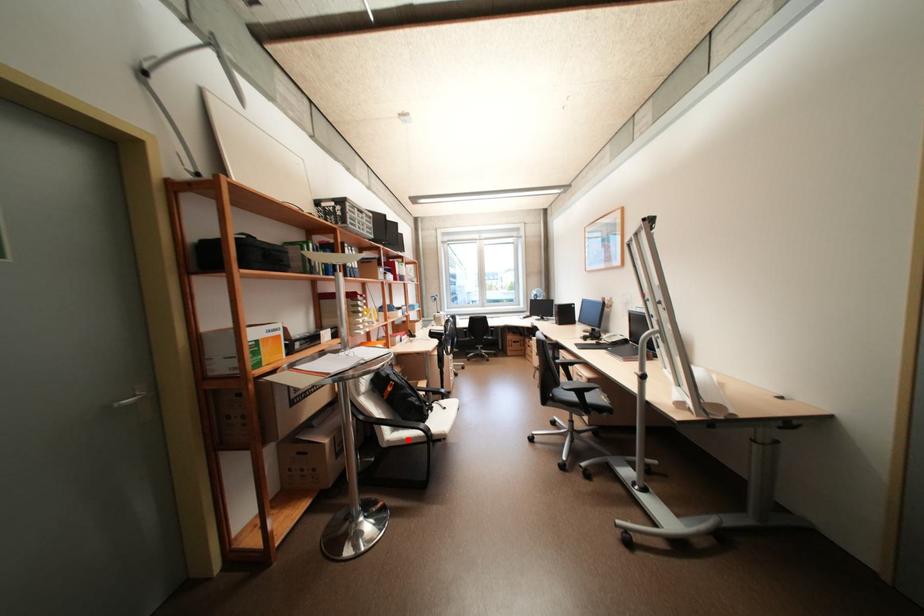
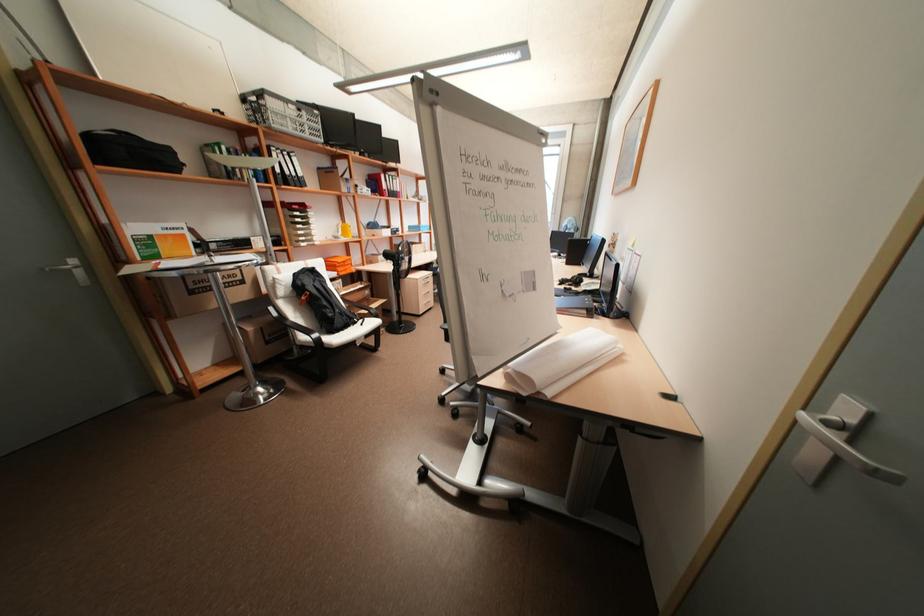
The point at the highlighted location is marked in the first image. Where is the corresponding point in the second image?

(311, 341)